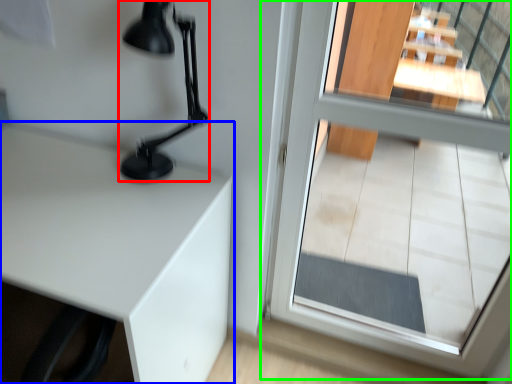
Question: Considering the real-world distances, which object is farthest from table lamp (highlighted by a red box)? table (highlighted by a blue box) or glass door (highlighted by a green box)?

Choices:
 (A) table
 (B) glass door

Answer: (B)